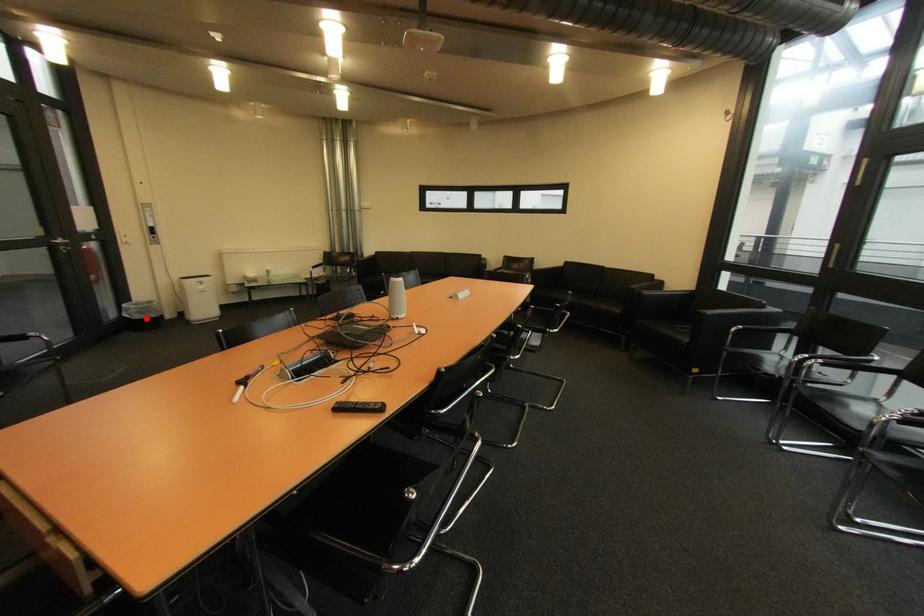
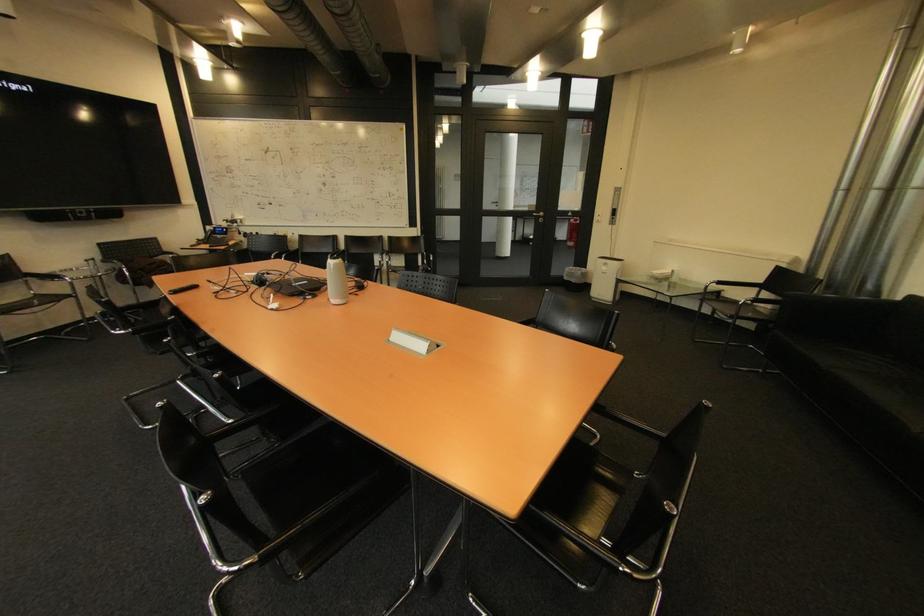
Question: I am providing you with two images of the same scene from different viewpoints. A red point is shown in image1. For the corresponding object point in image2, is it positioned nearer or farther from the camera?

Choices:
 (A) Nearer
 (B) Farther

Answer: (A)